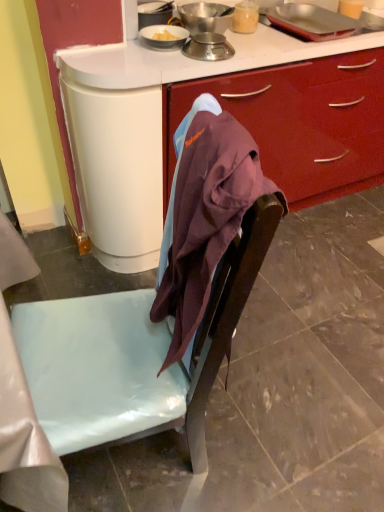
Question: Choose the correct answer: Is metallic silver scale at upper center, placed as the 3th kitchen appliance when sorted from right to left, inside metallic silver scale at upper center, the 2th kitchen appliance positioned from the right, or outside it?

Choices:
 (A) outside
 (B) inside

Answer: (A)

Question: Considering the positions of point (213, 9) and point (226, 52), is point (213, 9) closer or farther from the camera than point (226, 52)?

Choices:
 (A) closer
 (B) farther

Answer: (B)

Question: Estimate the real-world distances between objects in this image. Which object is farther from the metallic silver tray at upper right, positioned as the 3th kitchen appliance in left-to-right order?

Choices:
 (A) metallic silver scale at upper center, the 2th kitchen appliance positioned from the right
 (B) metallic silver scale at upper center, placed as the 3th kitchen appliance when sorted from right to left
 (C) matte brown chair at center

Answer: (C)

Question: Which is nearer to the metallic silver tray at upper right, positioned as the 3th kitchen appliance in left-to-right order?

Choices:
 (A) metallic silver scale at upper center, the first kitchen appliance in the left-to-right sequence
 (B) metallic silver scale at upper center, the 2th kitchen appliance positioned from the right
 (C) matte brown chair at center

Answer: (A)